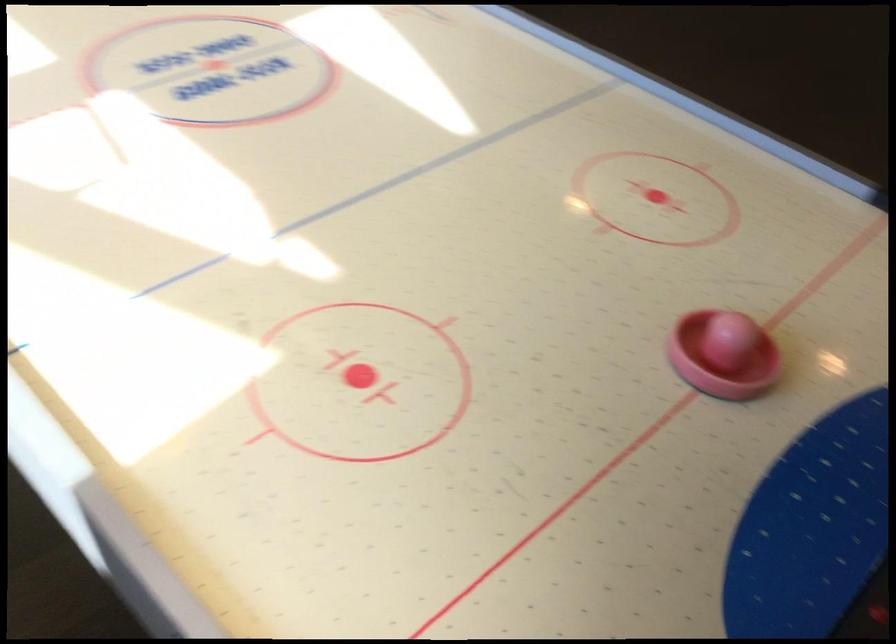
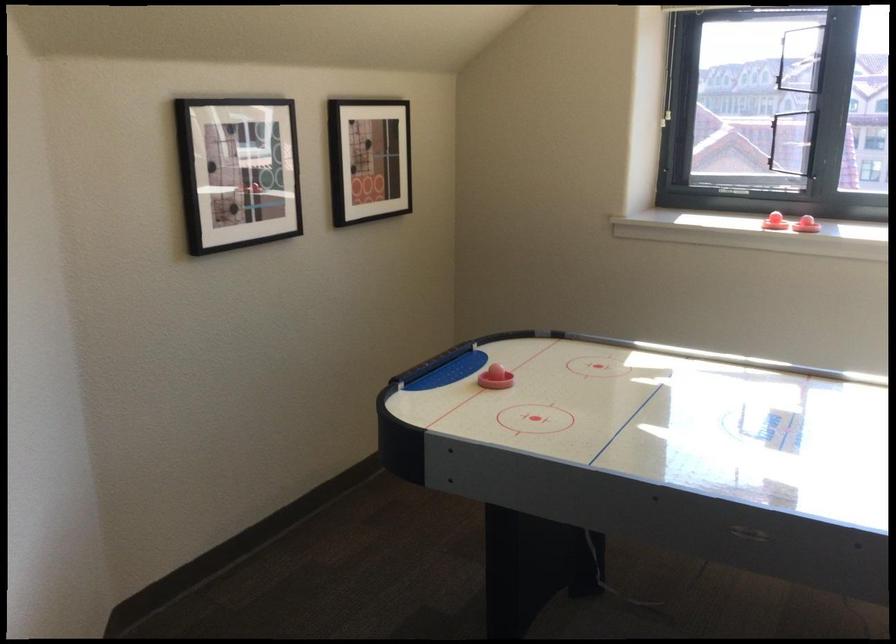
The point at (636, 292) is marked in the first image. Where is the corresponding point in the second image?

(495, 379)